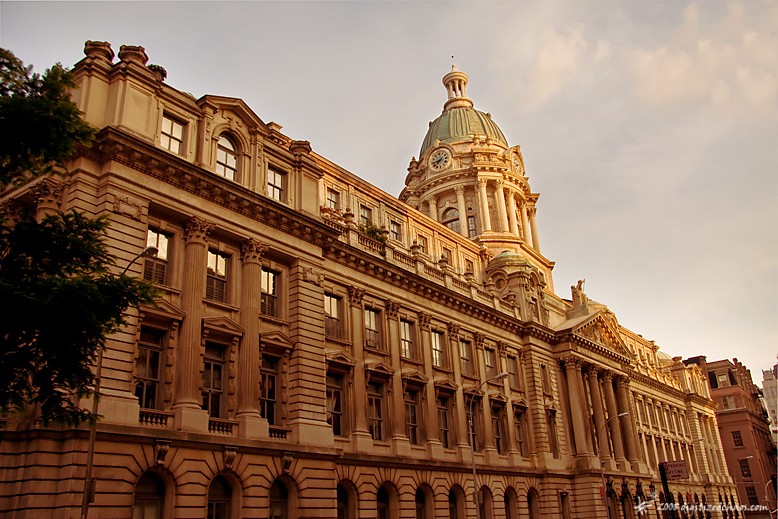
Where is `clock`? The height and width of the screenshot is (519, 778). clock is located at coordinates (440, 160), (513, 163).